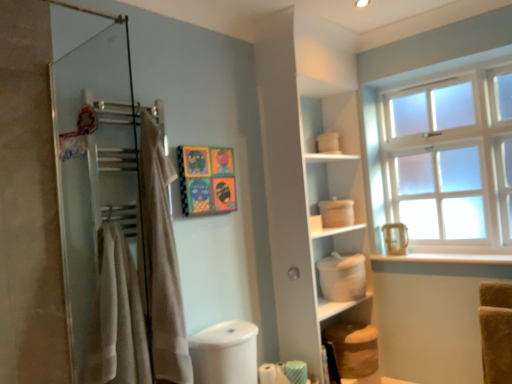
Find the location of `free point above white matte window sill at lower right (from a real-world perspective)`. free point above white matte window sill at lower right (from a real-world perspective) is located at coordinates (445, 251).